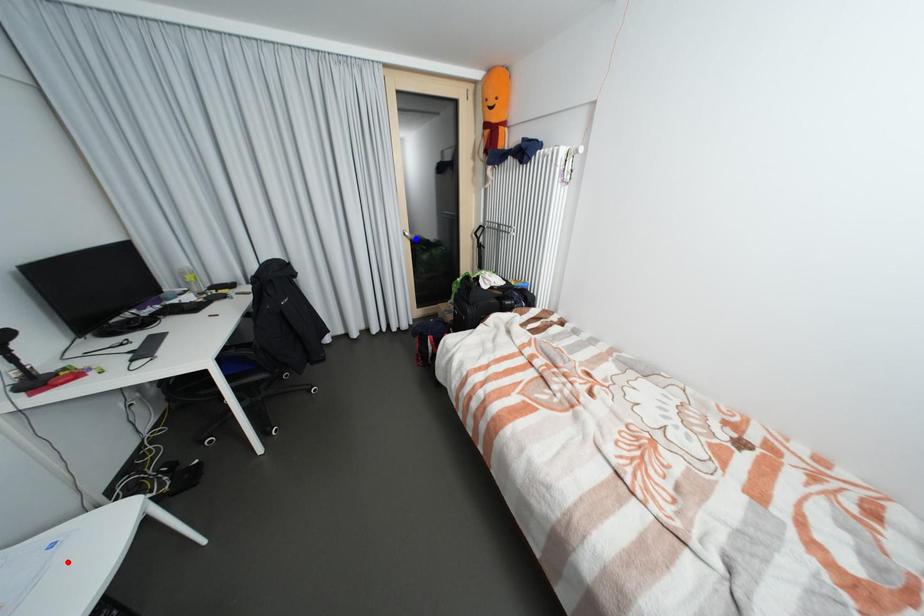
Question: Which of the two points in the image is closer to the camera?

Choices:
 (A) Blue point is closer.
 (B) Red point is closer.

Answer: (B)